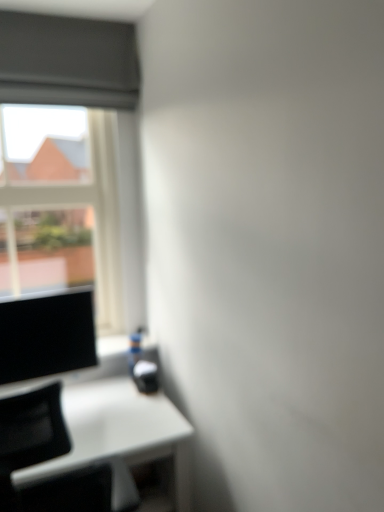
Question: Should I look upward or downward to see transparent glass window at upper left?

Choices:
 (A) down
 (B) up

Answer: (B)

Question: From the image's perspective, is white glossy table at lower left located beneath matte black monitor at left?

Choices:
 (A) yes
 (B) no

Answer: (A)

Question: From a real-world perspective, is white glossy table at lower left below matte black monitor at left?

Choices:
 (A) no
 (B) yes

Answer: (B)

Question: Is white glossy table at lower left thinner than matte black monitor at left?

Choices:
 (A) yes
 (B) no

Answer: (B)

Question: Considering the relative sizes of white glossy table at lower left and matte black monitor at left in the image provided, is white glossy table at lower left taller than matte black monitor at left?

Choices:
 (A) no
 (B) yes

Answer: (B)

Question: Is white glossy table at lower left shorter than matte black monitor at left?

Choices:
 (A) yes
 (B) no

Answer: (B)

Question: Is white glossy table at lower left looking in the opposite direction of matte black monitor at left?

Choices:
 (A) no
 (B) yes

Answer: (A)

Question: Considering the relative sizes of transparent glass window at upper left and matte black monitor at left in the image provided, is transparent glass window at upper left smaller than matte black monitor at left?

Choices:
 (A) no
 (B) yes

Answer: (A)

Question: Is transparent glass window at upper left looking in the opposite direction of matte black monitor at left?

Choices:
 (A) yes
 (B) no

Answer: (B)

Question: Would you say transparent glass window at upper left is a long distance from matte black monitor at left?

Choices:
 (A) yes
 (B) no

Answer: (B)

Question: Is transparent glass window at upper left thinner than matte black monitor at left?

Choices:
 (A) yes
 (B) no

Answer: (B)

Question: Is transparent glass window at upper left to the right of matte black monitor at left from the viewer's perspective?

Choices:
 (A) yes
 (B) no

Answer: (B)

Question: From the image's perspective, is transparent glass window at upper left over matte black monitor at left?

Choices:
 (A) yes
 (B) no

Answer: (A)

Question: Is matte black monitor at left outside of white glossy table at lower left?

Choices:
 (A) yes
 (B) no

Answer: (A)